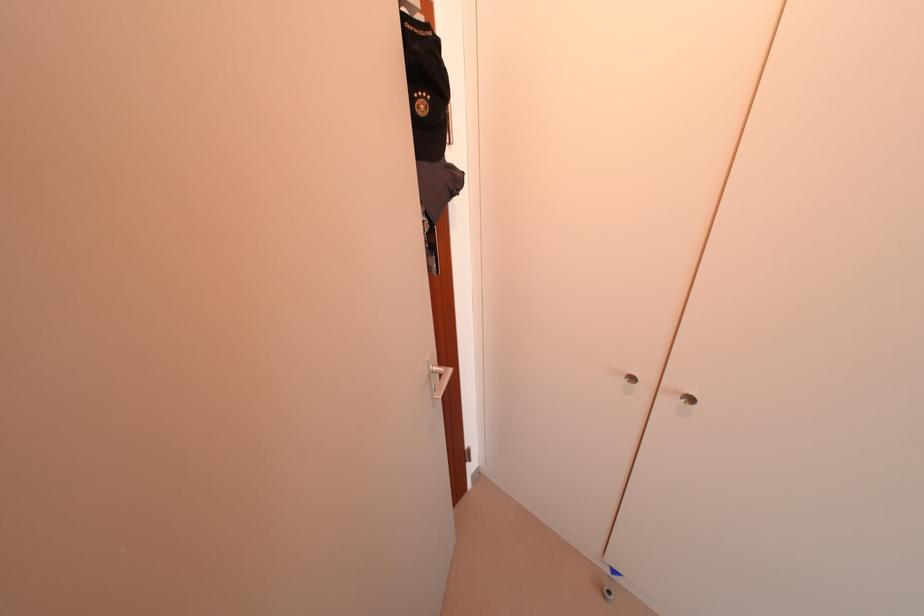
Find the location of `silver door handle`. silver door handle is located at coordinates (438, 379).